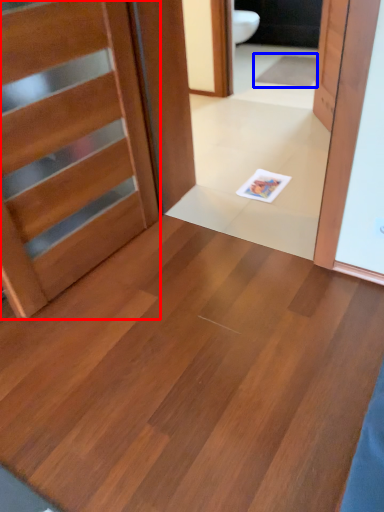
Question: Which point is closer to the camera, door (highlighted by a red box) or doormat (highlighted by a blue box)?

Choices:
 (A) door
 (B) doormat

Answer: (A)